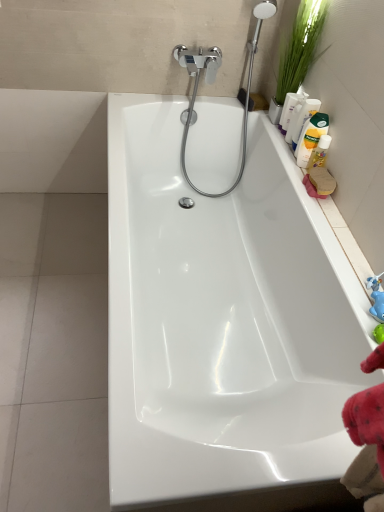
Question: Is yellow matte bottle at upper right, the first cleaning product from the top, next to translucent plastic bottle at upper right, which ranks as the 4th cleaning product in top-to-bottom order?

Choices:
 (A) no
 (B) yes

Answer: (A)

Question: From the image's perspective, does yellow matte bottle at upper right, the first cleaning product from the top, appear lower than translucent plastic bottle at upper right, the 1th cleaning product when ordered from bottom to top?

Choices:
 (A) no
 (B) yes

Answer: (A)

Question: Does yellow matte bottle at upper right, the first cleaning product from the top, have a lesser height compared to translucent plastic bottle at upper right, which ranks as the 4th cleaning product in top-to-bottom order?

Choices:
 (A) yes
 (B) no

Answer: (B)

Question: Can you confirm if yellow matte bottle at upper right, the first cleaning product from the top, is smaller than translucent plastic bottle at upper right, the 1th cleaning product when ordered from bottom to top?

Choices:
 (A) yes
 (B) no

Answer: (B)

Question: Is yellow matte bottle at upper right, the 4th cleaning product when ordered from bottom to top, behind translucent plastic bottle at upper right, which ranks as the 4th cleaning product in top-to-bottom order?

Choices:
 (A) yes
 (B) no

Answer: (A)

Question: Is yellow matte bottle at upper right, the 4th cleaning product when ordered from bottom to top, not near translucent plastic bottle at upper right, which ranks as the 4th cleaning product in top-to-bottom order?

Choices:
 (A) no
 (B) yes

Answer: (A)

Question: From a real-world perspective, is translucent plastic bottle at upper right, the 1th cleaning product when ordered from bottom to top, on white glossy bathtub at center?

Choices:
 (A) yes
 (B) no

Answer: (A)

Question: Considering the relative sizes of translucent plastic bottle at upper right, which ranks as the 4th cleaning product in top-to-bottom order, and white glossy bathtub at center in the image provided, is translucent plastic bottle at upper right, which ranks as the 4th cleaning product in top-to-bottom order, shorter than white glossy bathtub at center?

Choices:
 (A) no
 (B) yes

Answer: (B)

Question: Does translucent plastic bottle at upper right, which ranks as the 4th cleaning product in top-to-bottom order, have a lesser width compared to white glossy bathtub at center?

Choices:
 (A) no
 (B) yes

Answer: (B)

Question: Does translucent plastic bottle at upper right, the 1th cleaning product when ordered from bottom to top, touch white glossy bathtub at center?

Choices:
 (A) yes
 (B) no

Answer: (B)

Question: Is the position of translucent plastic bottle at upper right, which ranks as the 4th cleaning product in top-to-bottom order, less distant than that of white glossy bathtub at center?

Choices:
 (A) no
 (B) yes

Answer: (A)

Question: Is translucent plastic bottle at upper right, the 1th cleaning product when ordered from bottom to top, aimed at white glossy bathtub at center?

Choices:
 (A) no
 (B) yes

Answer: (A)

Question: Can you confirm if white glossy bathtub at center is shorter than green leafy plant at upper right?

Choices:
 (A) no
 (B) yes

Answer: (A)